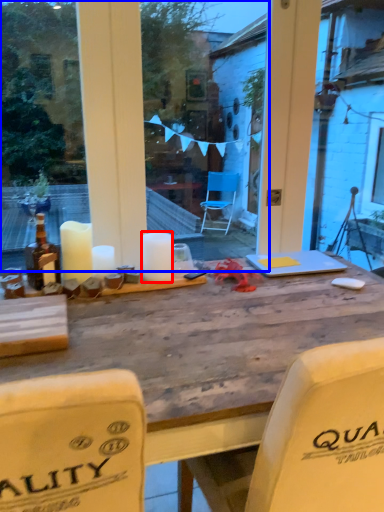
Question: Which of the following is the closest to the observer, candle (highlighted by a red box) or glass window (highlighted by a blue box)?

Choices:
 (A) candle
 (B) glass window

Answer: (B)